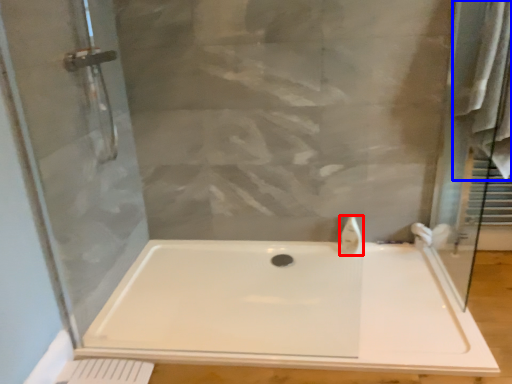
Question: Which object is closer to the camera taking this photo, faucet (highlighted by a red box) or bath towel (highlighted by a blue box)?

Choices:
 (A) faucet
 (B) bath towel

Answer: (B)